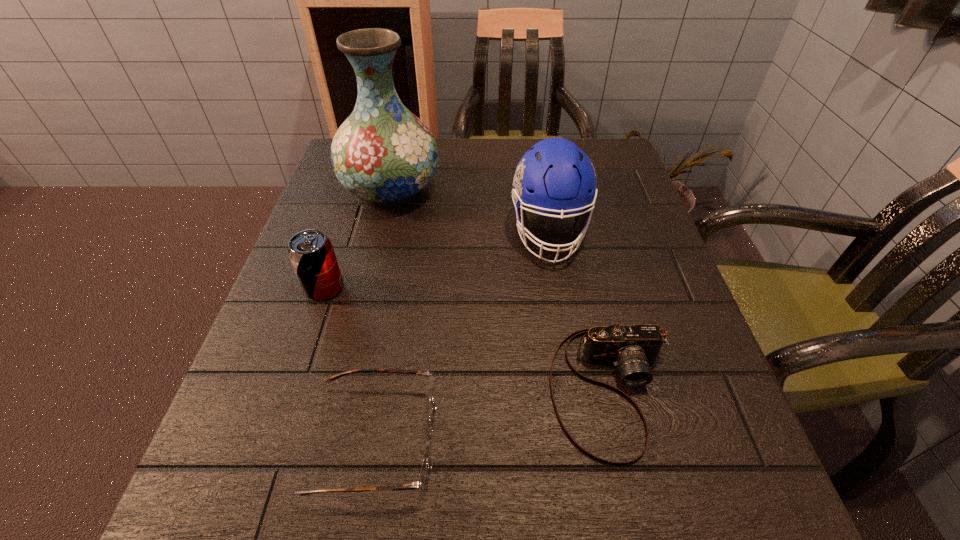
This screenshot has height=540, width=960. Identify the location of vacant space at the far edge. (491, 149).

Image resolution: width=960 pixels, height=540 pixels. In order to click on vacant area at the left edge in this screenshot , I will do `click(317, 466)`.

Find the location of a particular element. This screenshot has width=960, height=540. blank space at the right edge of the desktop is located at coordinates (619, 189).

In the image, there is a desktop. In order to click on free region at the far right corner in this screenshot , I will do `click(598, 165)`.

Identify the location of free space between the fourth tallest object and the football helmet. (580, 311).

You are a GUI agent. You are given a task and a screenshot of the screen. Output one action in this format:
    pyautogui.click(x=<x>, y=<y>)
    Task: Click on the unoccupied position between the fourth tallest object and the tallest object
    
    Given the screenshot: What is the action you would take?
    pyautogui.click(x=501, y=290)

You are a GUI agent. You are given a task and a screenshot of the screen. Output one action in this format:
    pyautogui.click(x=<x>, y=<y>)
    Task: Click on the blank region between the fourth shortest object and the third nearest object
    This screenshot has width=960, height=540.
    Given the screenshot: What is the action you would take?
    pyautogui.click(x=437, y=260)

This screenshot has height=540, width=960. Identify the location of free space between the football helmet and the camera. (580, 311).

Where is `empty space between the vase and the third nearest object`? Image resolution: width=960 pixels, height=540 pixels. empty space between the vase and the third nearest object is located at coordinates 358,239.

I want to click on free spot between the spectacles and the second tallest object, so click(x=463, y=336).